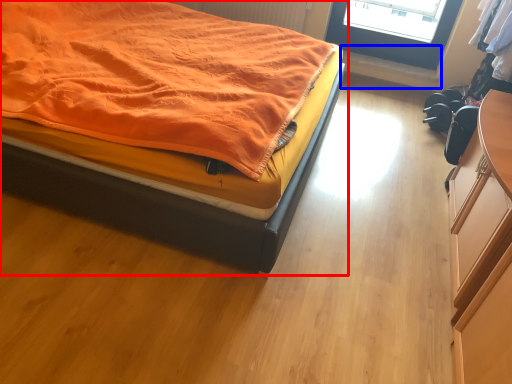
Question: Which point is closer to the camera, bed (highlighted by a red box) or window sill (highlighted by a blue box)?

Choices:
 (A) bed
 (B) window sill

Answer: (A)